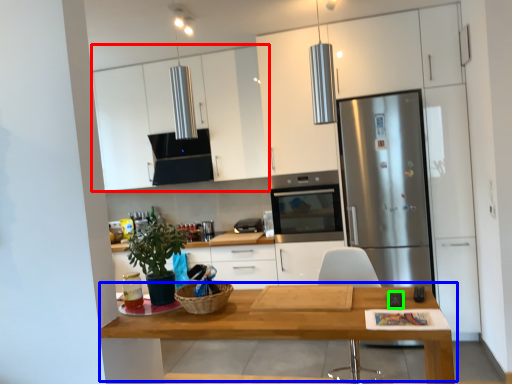
Question: Which is farther away from cabinetry (highlighted by a red box)? table (highlighted by a blue box) or appliance (highlighted by a green box)?

Choices:
 (A) table
 (B) appliance

Answer: (B)